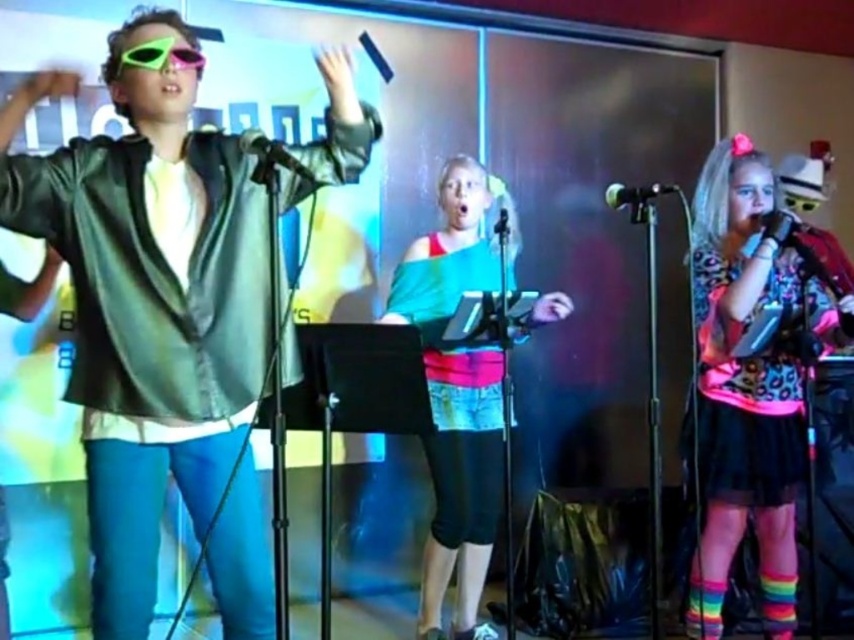
Question: Which point is farther to the camera?

Choices:
 (A) neon plastic sunglasses at upper left
 (B) black plastic microphone at center
 (C) shiny green jacket at left

Answer: (B)

Question: Which point is farther to the camera?

Choices:
 (A) metallic silver microphone at right
 (B) green matte microphone at center
 (C) multicolored fabric dress at center

Answer: (B)

Question: Which object is the closest to the metallic silver microphone at right?

Choices:
 (A) black plastic microphone at center
 (B) shiny green jacket at left

Answer: (A)

Question: Considering the relative positions of multicolored fabric dress at center and black metallic microphone at center in the image provided, where is multicolored fabric dress at center located with respect to black metallic microphone at center?

Choices:
 (A) right
 (B) left

Answer: (A)

Question: Is shiny green jacket at left smaller than neon pink tulle skirt at right?

Choices:
 (A) yes
 (B) no

Answer: (B)

Question: Considering the relative positions of metallic silver microphone at right and black metallic microphone at center in the image provided, where is metallic silver microphone at right located with respect to black metallic microphone at center?

Choices:
 (A) above
 (B) below

Answer: (B)